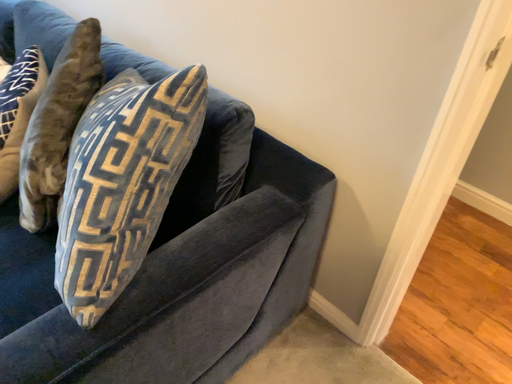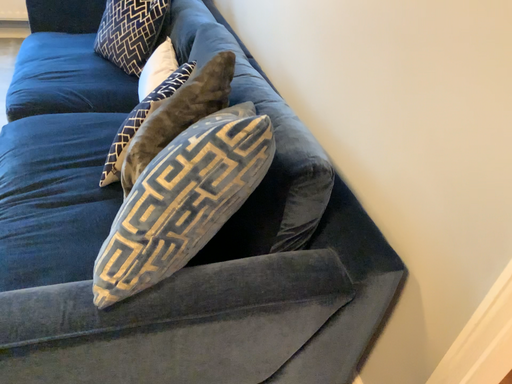
Question: How did the camera likely rotate when shooting the video?

Choices:
 (A) rotated downward
 (B) rotated upward

Answer: (B)